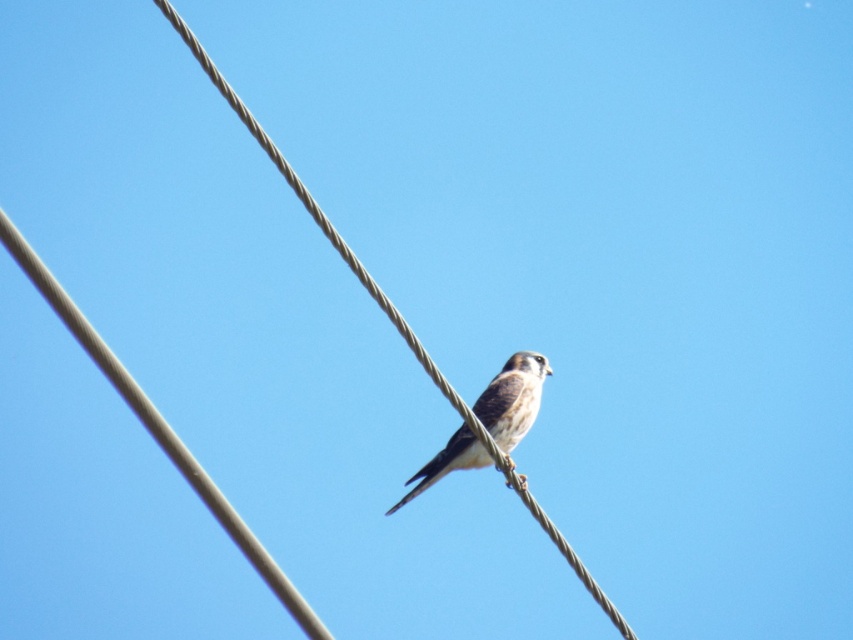
What do you see at coordinates (326, 225) in the screenshot? I see `gray wire at center` at bounding box center [326, 225].

Does gray wire at center appear on the left side of brown speckled feathers at center?

Yes, gray wire at center is to the left of brown speckled feathers at center.

Looking at this image, measure the distance between gray wire at center and camera.

A distance of 11.57 meters exists between gray wire at center and camera.

You are a GUI agent. You are given a task and a screenshot of the screen. Output one action in this format:
    pyautogui.click(x=<x>, y=<y>)
    Task: Click on the gray wire at center
    Image resolution: width=853 pixels, height=640 pixels.
    Given the screenshot: What is the action you would take?
    pyautogui.click(x=326, y=225)